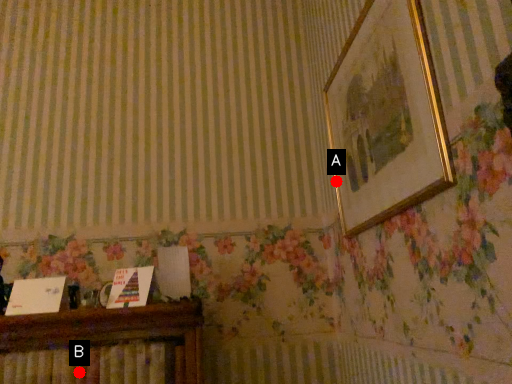
Question: Two points are circled on the image, labeled by A and B beside each circle. Which of the following is the farthest from the observer?

Choices:
 (A) A is further
 (B) B is further

Answer: (A)